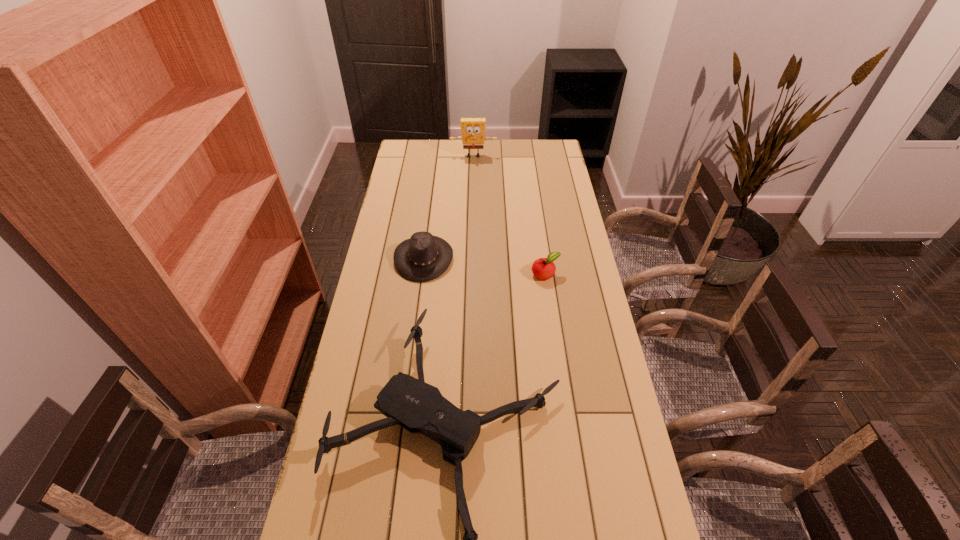
Locate an element on the screen. Image resolution: width=960 pixels, height=540 pixels. vacant space at the far edge of the desktop is located at coordinates (515, 165).

The image size is (960, 540). In the image, there is a desktop. Identify the location of vacant space at the left edge. (329, 539).

You are a GUI agent. You are given a task and a screenshot of the screen. Output one action in this format:
    pyautogui.click(x=<x>, y=<y>)
    Task: Click on the free point at the right edge
    The height and width of the screenshot is (540, 960).
    Given the screenshot: What is the action you would take?
    (563, 252)

You are a GUI agent. You are given a task and a screenshot of the screen. Output one action in this format:
    pyautogui.click(x=<x>, y=<y>)
    Task: Click on the vacant area between the tallest object and the apple
    This screenshot has height=540, width=960.
    Given the screenshot: What is the action you would take?
    pyautogui.click(x=510, y=215)

Locate an element on the screen. This screenshot has width=960, height=540. vacant point located between the hat and the shortest object is located at coordinates (485, 266).

Identify the location of empty space between the hat and the sponge. This screenshot has height=540, width=960. (448, 207).

This screenshot has height=540, width=960. I want to click on object that stands as the third closest to the hat, so click(473, 129).

Point out which object is positioned as the second nearest to the farthest object. Please provide its 2D coordinates. Your answer should be formatted as a tuple, i.e. [(x, y)], where the tuple contains the x and y coordinates of a point satisfying the conditions above.

[(543, 268)]

In order to click on vacant point that satisfies the following two spatial constraints: 1. on the face of the tallest object; 2. on the right side of the apple in this screenshot , I will do `click(471, 274)`.

Identify the location of vacant region that satisfies the following two spatial constraints: 1. on the face of the apple; 2. on the left side of the tallest object. (471, 274).